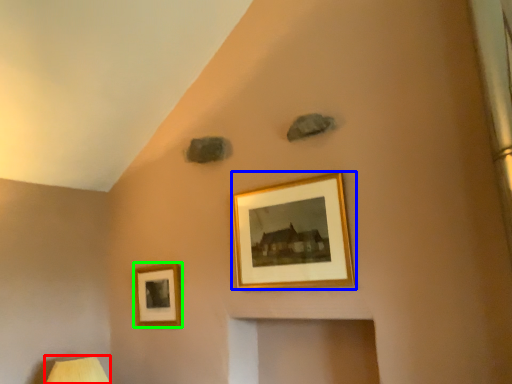
Question: Based on their relative distances, which object is farther from table lamp (highlighted by a red box)? Choose from picture frame (highlighted by a blue box) and picture frame (highlighted by a green box).

Choices:
 (A) picture frame
 (B) picture frame

Answer: (A)